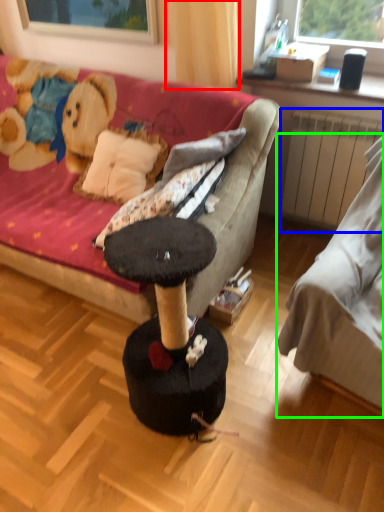
Question: Which is farther away from curtain (highlighted by a red box)? radiator (highlighted by a blue box) or studio couch (highlighted by a green box)?

Choices:
 (A) radiator
 (B) studio couch

Answer: (B)